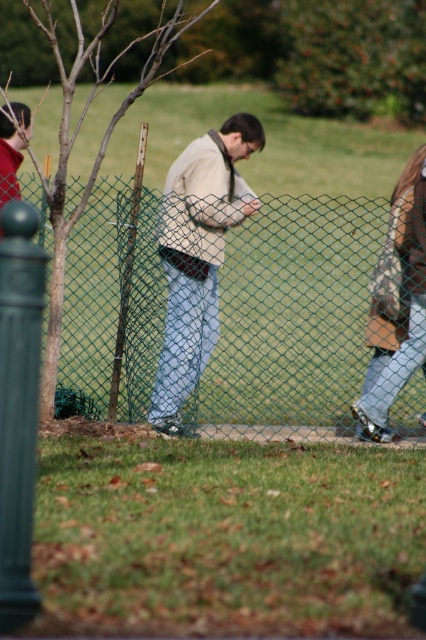
Does camouflage jacket at right have a greater width compared to matte black jacket at left?

Correct, the width of camouflage jacket at right exceeds that of matte black jacket at left.

Image resolution: width=426 pixels, height=640 pixels. What do you see at coordinates (397, 304) in the screenshot?
I see `camouflage jacket at right` at bounding box center [397, 304].

The height and width of the screenshot is (640, 426). I want to click on camouflage jacket at right, so click(x=397, y=304).

Is light beige sweater at center to the left of camouflage jacket at right from the viewer's perspective?

Yes, light beige sweater at center is to the left of camouflage jacket at right.

From the picture: Between light beige sweater at center and camouflage jacket at right, which one has less height?

With less height is camouflage jacket at right.

In order to click on light beige sweater at center in this screenshot , I will do `click(198, 256)`.

Find the location of `light beige sweater at center`. light beige sweater at center is located at coordinates (198, 256).

Is green chain-link fence at center smaller than light beige sweater at center?

Actually, green chain-link fence at center might be larger than light beige sweater at center.

Does green chain-link fence at center appear on the right side of light beige sweater at center?

Correct, you'll find green chain-link fence at center to the right of light beige sweater at center.

Is point (118, 266) positioned before point (218, 198)?

No, (118, 266) is further to viewer.

What are the coordinates of `green chain-link fence at center` in the screenshot? It's located at (293, 314).